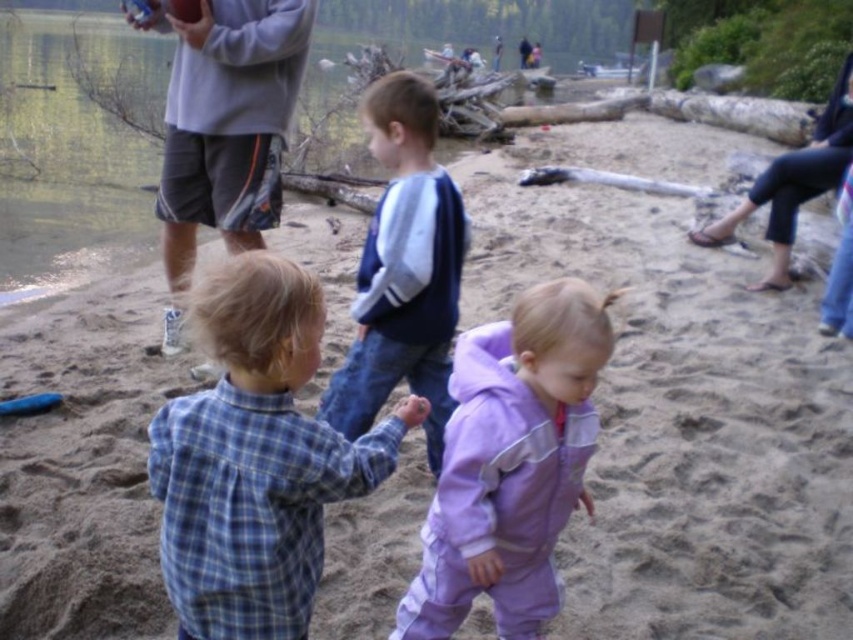
Is blue fleece jacket at center taller than purple fleece jacket at upper right?

Incorrect, blue fleece jacket at center's height is not larger of purple fleece jacket at upper right's.

Based on the photo, can you confirm if blue fleece jacket at center is positioned above purple fleece jacket at upper right?

No.

Does point (405, 352) lie behind point (793, 161)?

That is False.

Find the location of a particular element. This screenshot has height=640, width=853. blue fleece jacket at center is located at coordinates (403, 269).

Can you confirm if blue plaid shirt at center is shorter than matte gray water at upper left?

Yes, blue plaid shirt at center is shorter than matte gray water at upper left.

Does blue plaid shirt at center have a greater height compared to matte gray water at upper left?

Incorrect, blue plaid shirt at center's height is not larger of matte gray water at upper left's.

Find the location of a particular element. This screenshot has height=640, width=853. blue plaid shirt at center is located at coordinates (256, 460).

Between purple fleece suit at center and gray fabric shorts at upper left, which one has more height?

With more height is gray fabric shorts at upper left.

The width and height of the screenshot is (853, 640). I want to click on purple fleece suit at center, so click(x=511, y=464).

Who is more distant from viewer, (573, 310) or (297, 74)?

Positioned behind is point (297, 74).

The height and width of the screenshot is (640, 853). What are the coordinates of `purple fleece suit at center` in the screenshot? It's located at (511, 464).